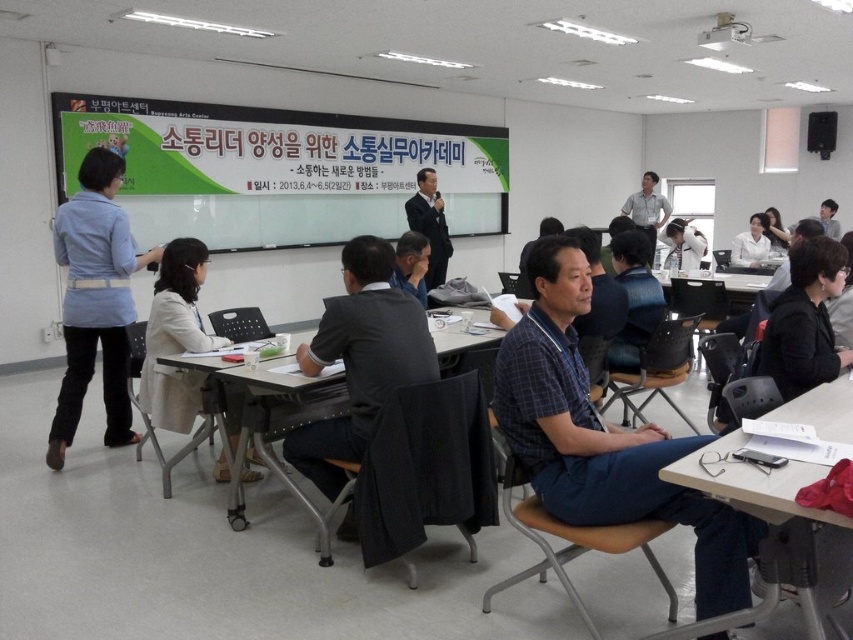
You are a student who needs to place a 4 feet long project board between the beige fabric coat at lower left and the wooden table at center. Can you fit it there without bending the board?

The distance between the beige fabric coat at lower left and the wooden table at center is 3.99 feet, which is slightly less than the 4 feet length of the project board. Therefore, the board cannot be placed straight between them without bending.

You are a photographer standing at the back of the classroom. You want to take a photo of the light blue shirt at left and the white plastic table at lower right so that both are clearly visible. Considering their heights, which object might block the view of the other when framing the shot?

The light blue shirt at left is much taller than the white plastic table at lower right, so the light blue shirt at left might block the view of the white plastic table at lower right when framing the shot.